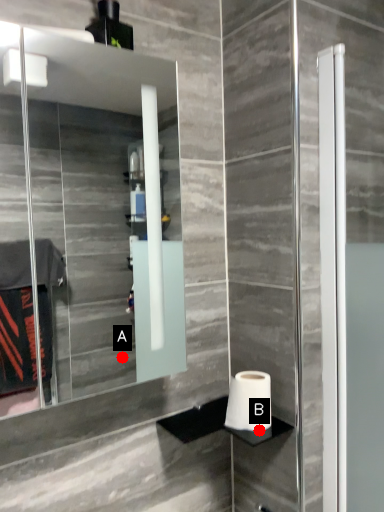
Question: Two points are circled on the image, labeled by A and B beside each circle. Among these points, which one is nearest to the camera?

Choices:
 (A) A is closer
 (B) B is closer

Answer: (B)